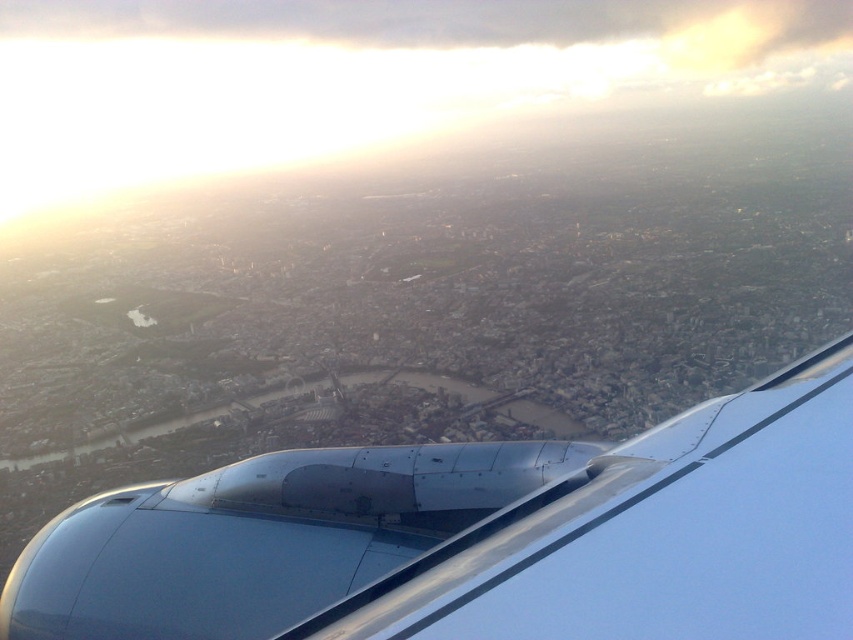
Is metallic blue engine at lower right shorter than transparent glass airplane window at lower left?

No, metallic blue engine at lower right is not shorter than transparent glass airplane window at lower left.

Who is positioned more to the left, metallic blue engine at lower right or transparent glass airplane window at lower left?

From the viewer's perspective, transparent glass airplane window at lower left appears more on the left side.

Where is `metallic blue engine at lower right`? This screenshot has width=853, height=640. metallic blue engine at lower right is located at coordinates (480, 536).

Can you confirm if metallic blue engine at lower right is positioned above white fluffy cloud at upper center?

No, metallic blue engine at lower right is not above white fluffy cloud at upper center.

Which is in front, point (527, 442) or point (64, 120)?

Point (527, 442) is in front.

Find the location of a particular element. The image size is (853, 640). metallic blue engine at lower right is located at coordinates (480, 536).

Which is below, white fluffy cloud at upper center or transparent glass airplane window at lower left?

transparent glass airplane window at lower left is lower down.

Does white fluffy cloud at upper center have a lesser width compared to transparent glass airplane window at lower left?

No, white fluffy cloud at upper center is not thinner than transparent glass airplane window at lower left.

Describe the element at coordinates (363, 77) in the screenshot. I see `white fluffy cloud at upper center` at that location.

This screenshot has width=853, height=640. Find the location of `white fluffy cloud at upper center`. white fluffy cloud at upper center is located at coordinates (363, 77).